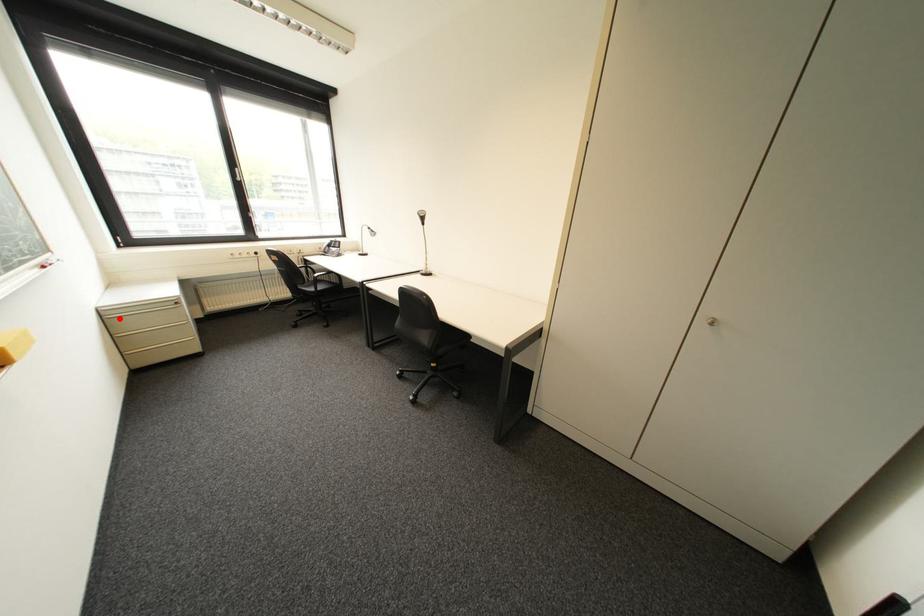
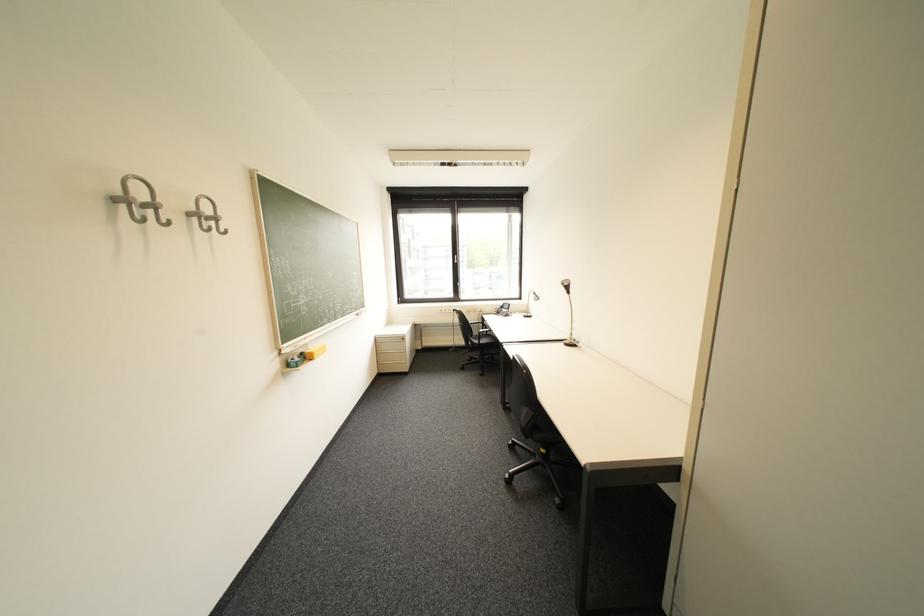
In the second image, find the point that corresponds to the highlighted location in the first image.

(388, 342)